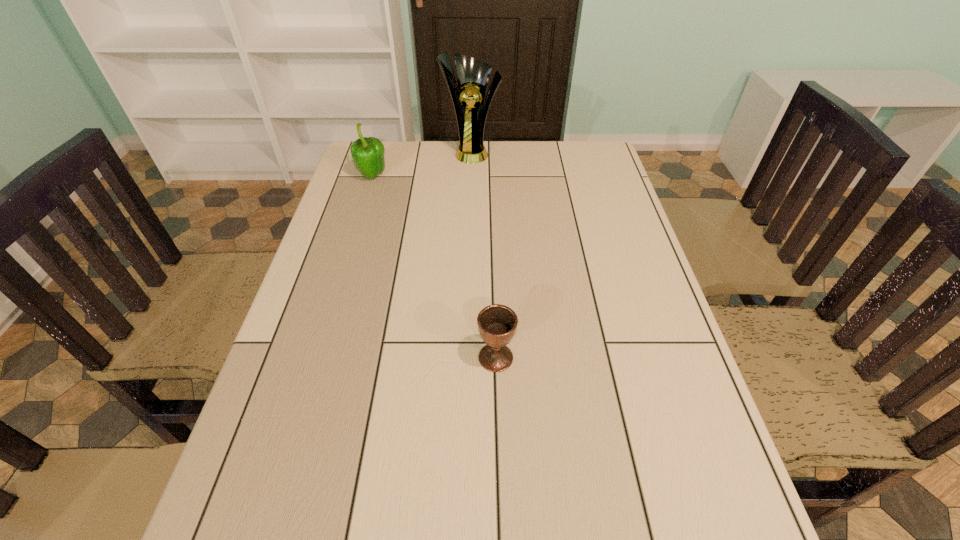
Locate an element on the screen. This screenshot has width=960, height=540. blank area in the image that satisfies the following two spatial constraints: 1. at the front of the nearest object, where the globe is visible; 2. on the right side of the tallest object is located at coordinates (466, 357).

What are the coordinates of `free spot that satisfies the following two spatial constraints: 1. at the front of the nearest object, where the globe is visible; 2. on the left side of the farthest object` in the screenshot? It's located at (466, 357).

Locate an element on the screen. This screenshot has width=960, height=540. vacant region that satisfies the following two spatial constraints: 1. at the front of the shortest object, where the globe is visible; 2. on the left side of the award is located at coordinates (466, 357).